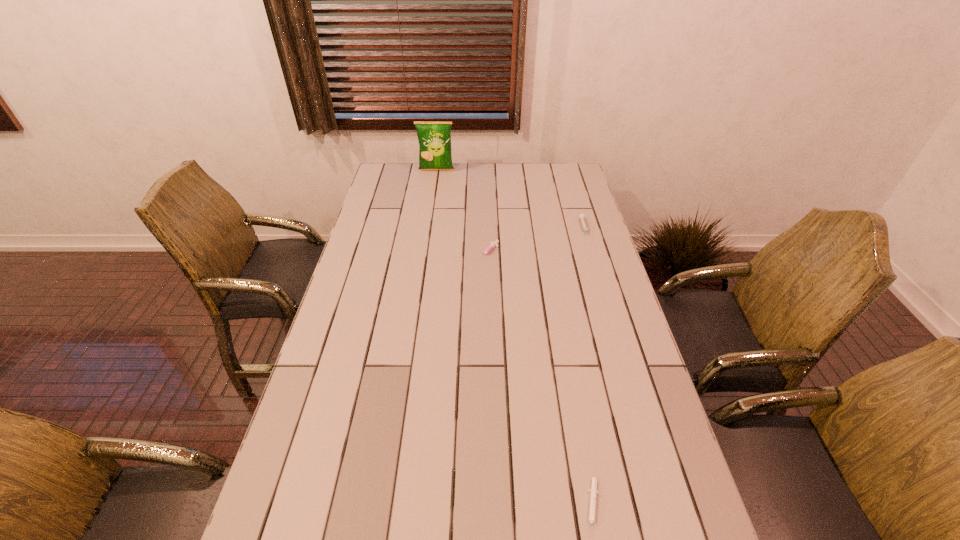
Where is `vacant area between the second nearest object and the crisp (potato chip)`? This screenshot has width=960, height=540. vacant area between the second nearest object and the crisp (potato chip) is located at coordinates (463, 211).

Locate which object ranks second in proximity to the farthest object. Please provide its 2D coordinates. Your answer should be formatted as a tuple, i.e. [(x, y)], where the tuple contains the x and y coordinates of a point satisfying the conditions above.

[(581, 216)]

Identify which object is the third closest to the farthest syringe. Please provide its 2D coordinates. Your answer should be formatted as a tuple, i.e. [(x, y)], where the tuple contains the x and y coordinates of a point satisfying the conditions above.

[(593, 490)]

Identify which syringe is located as the second nearest to the second object from right to left. Please provide its 2D coordinates. Your answer should be formatted as a tuple, i.e. [(x, y)], where the tuple contains the x and y coordinates of a point satisfying the conditions above.

[(581, 216)]

The height and width of the screenshot is (540, 960). Find the location of `syringe identified as the closest to the third object from left to right`. syringe identified as the closest to the third object from left to right is located at coordinates [492, 245].

Identify the location of free space that satisfies the following two spatial constraints: 1. on the front-facing side of the second nearest object; 2. on the right side of the tallest object. This screenshot has height=540, width=960. (424, 253).

You are a GUI agent. You are given a task and a screenshot of the screen. Output one action in this format:
    pyautogui.click(x=<x>, y=<y>)
    Task: Click on the vacant space that satisfies the following two spatial constraints: 1. on the front-facing side of the crisp (potato chip); 2. on the left side of the leftmost syringe
    
    Given the screenshot: What is the action you would take?
    pyautogui.click(x=424, y=253)

Where is `free space that satisfies the following two spatial constraints: 1. on the front-facing side of the crisp (potato chip); 2. on the right side of the second nearest object`? The height and width of the screenshot is (540, 960). free space that satisfies the following two spatial constraints: 1. on the front-facing side of the crisp (potato chip); 2. on the right side of the second nearest object is located at coordinates (424, 253).